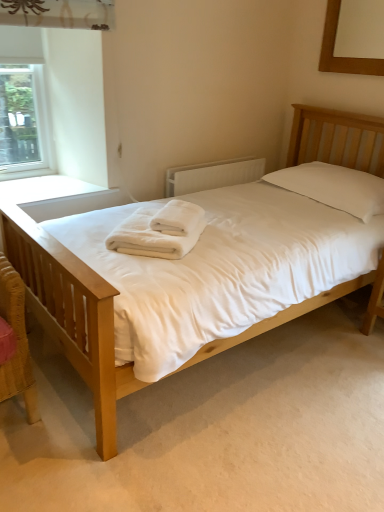
Locate an element on the screen. The width and height of the screenshot is (384, 512). vacant point above white soft towel at center, which ranks as the first bath towel in bottom-to-top order (from a real-world perspective) is located at coordinates (161, 221).